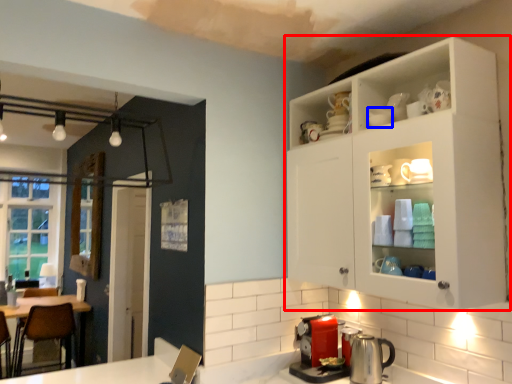
Question: Which object is further to the camera taking this photo, cabinetry (highlighted by a red box) or tableware (highlighted by a blue box)?

Choices:
 (A) cabinetry
 (B) tableware

Answer: (B)